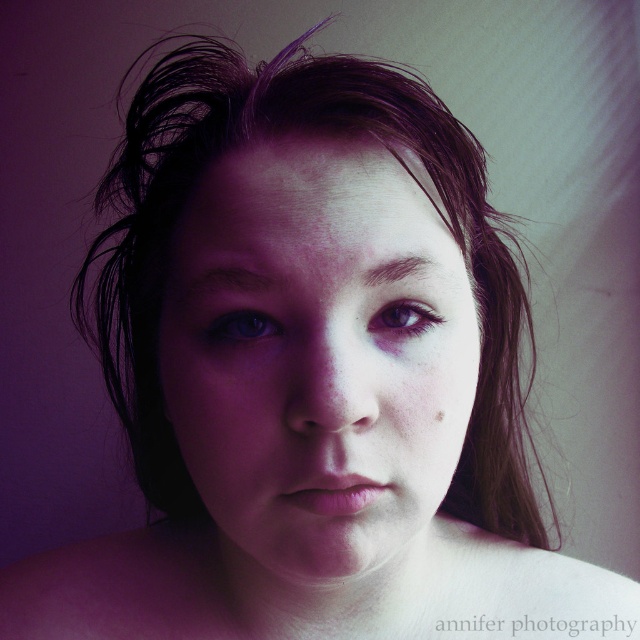
Question: Which object appears farthest from the camera in this image?

Choices:
 (A) purple matte eye at center
 (B) brown matte freckle at center

Answer: (B)

Question: Observing the image, what is the correct spatial positioning of purple matte eye at center in reference to brown matte freckle at center?

Choices:
 (A) above
 (B) below

Answer: (A)

Question: Which of the following is the closest to the observer?

Choices:
 (A) purple matte eye at center
 (B) blue glossy eye at center

Answer: (B)

Question: Which point is farther from the camera taking this photo?

Choices:
 (A) [385, 321]
 (B) [438, 420]

Answer: (B)

Question: Can you confirm if purple matte eye at center is wider than brown matte freckle at center?

Choices:
 (A) no
 (B) yes

Answer: (B)

Question: Does smooth skin face at center have a greater width compared to purple matte eye at center?

Choices:
 (A) yes
 (B) no

Answer: (A)